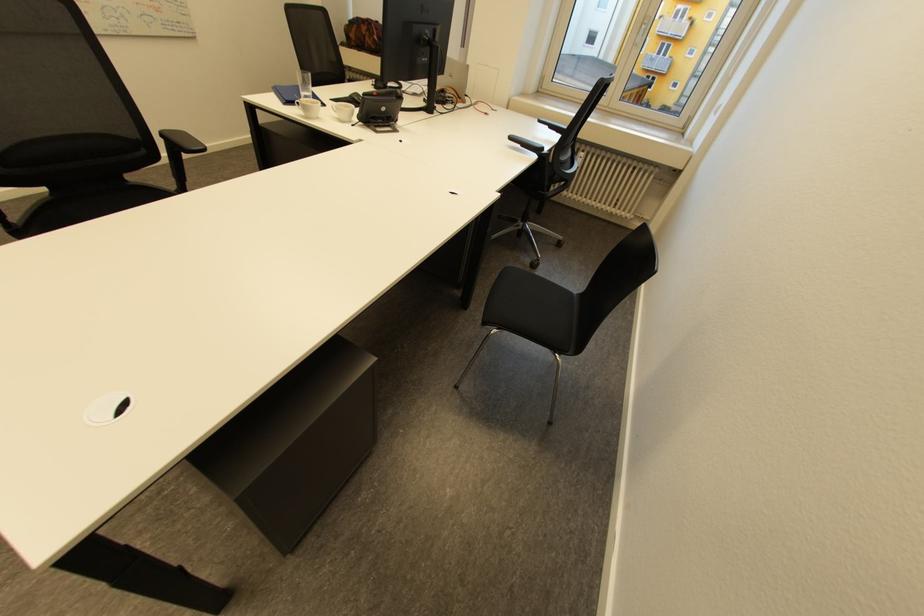
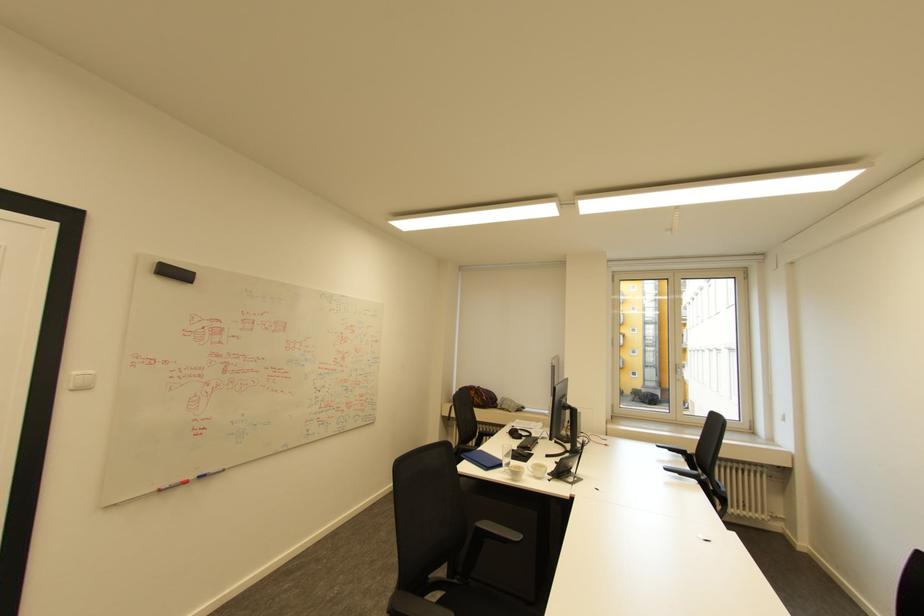
Where in the second image is the point corresponding to pixel 342 116 from the first image?

(539, 474)